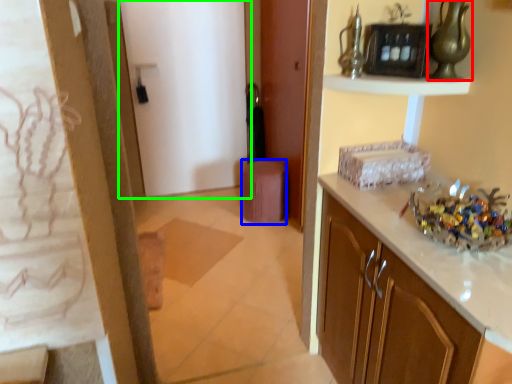
Question: Based on their relative distances, which object is farther from glass vase (highlighted by a red box)? Choose from stool (highlighted by a blue box) and door (highlighted by a green box).

Choices:
 (A) stool
 (B) door

Answer: (B)